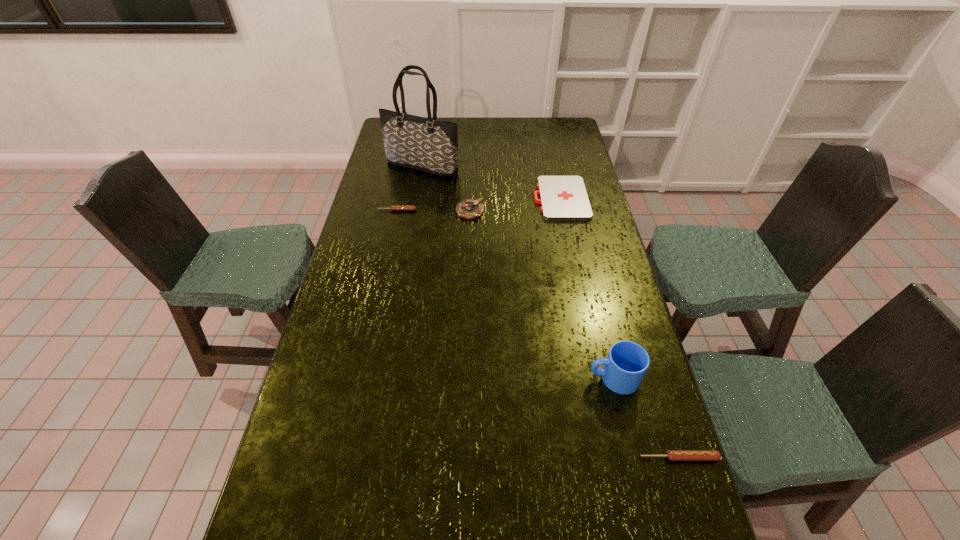
Where is `the farther sausage`? This screenshot has width=960, height=540. the farther sausage is located at coordinates (394, 208).

Locate an element on the screen. the shorter sausage is located at coordinates (394, 208).

Locate an element on the screen. the fourth tallest object is located at coordinates (673, 455).

Image resolution: width=960 pixels, height=540 pixels. Identify the location of the taller sausage. (673, 455).

The height and width of the screenshot is (540, 960). Find the location of `the fourth shortest object`. the fourth shortest object is located at coordinates (470, 209).

Find the location of `the farthest object`. the farthest object is located at coordinates (427, 144).

At what (x,y) coordinates should I click in order to perform the action: click on the tallest object. Please return your answer as a coordinate pair (x, y). This screenshot has width=960, height=540. Looking at the image, I should click on click(427, 144).

Image resolution: width=960 pixels, height=540 pixels. In order to click on the shortest object in this screenshot , I will do `click(563, 198)`.

This screenshot has height=540, width=960. I want to click on the second nearest object, so click(x=627, y=362).

I want to click on mug, so click(627, 362).